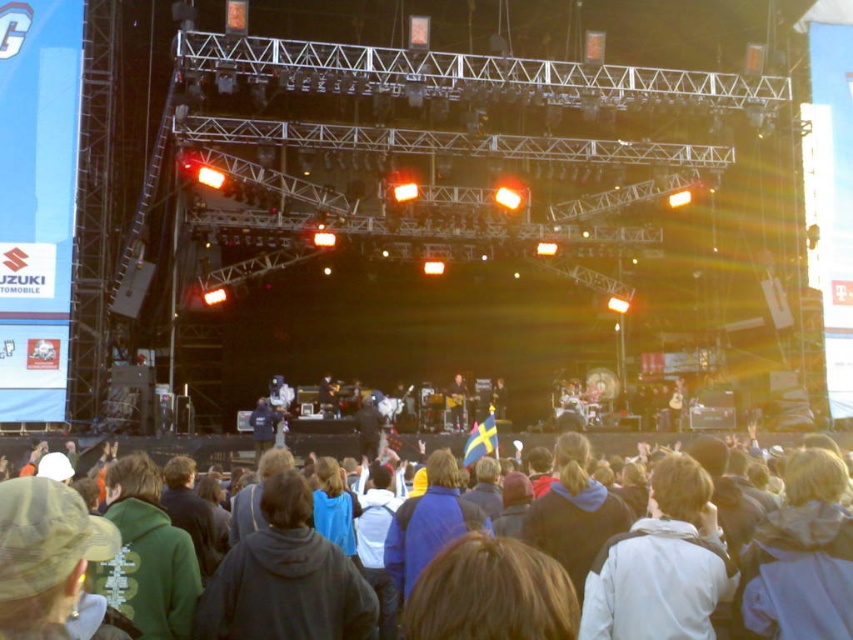
You are a photographer at the concert trying to capture a photo of the crowd. You notice the white matte jacket at center and the dark gray hoodie at center. Which clothing item appears taller in the photo?

The white matte jacket at center appears taller than the dark gray hoodie at center in the photo.

You are a photographer standing at the back of the concert venue. You want to take a photo that includes both the dark gray hoodie at center and the dark blue jacket at center. Given that your camera has a maximum zoom range of 10 meters, can you capture both subjects in the same frame without moving closer?

The dark gray hoodie at center and dark blue jacket at center are 15.73 meters apart from each other. Since the camera can only zoom up to 10 meters, the distance between them exceeds the maximum zoom range. Therefore, you cannot capture both subjects in the same frame without moving closer.